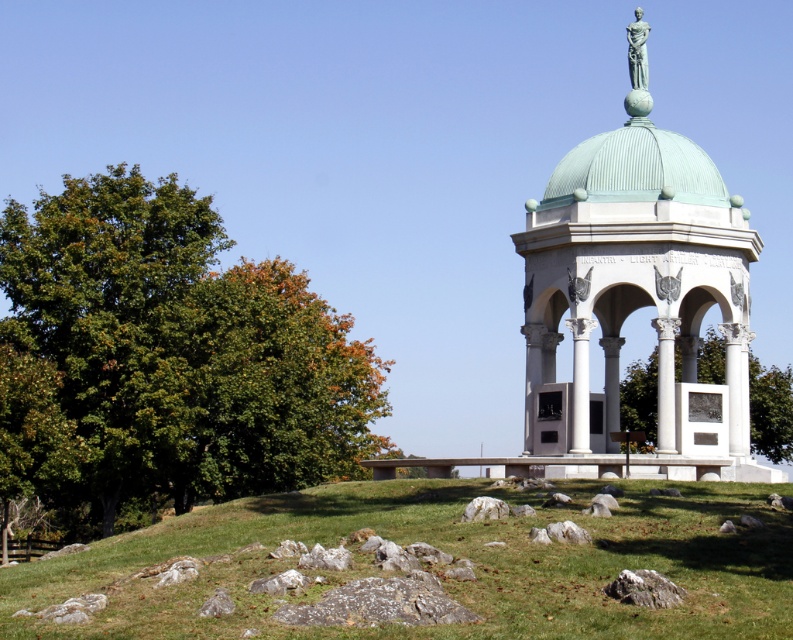
You are standing at the base of the grassy hill and want to walk towards the pavilion. There is green grass at lower center and a green leafy tree at center in your path. Which object do you need to walk around if you want to avoid stepping on the wider area?

You need to walk around the green grass at lower center because its width is larger than the green leafy tree at center, making it the wider area to avoid.

Please provide the coordinates of the green grass at lower center in the image. The coordinate system uses the bottom left corner as the origin point with x and y values ranging from 0 to 1.

The green grass at lower center is located at coordinates point (439, 577).

You are standing in the outdoor scene looking at the pavilion. You notice a green leafy tree at left and green grass at lower center. Which object is taller?

The green leafy tree at left is taller than the green grass at lower center.